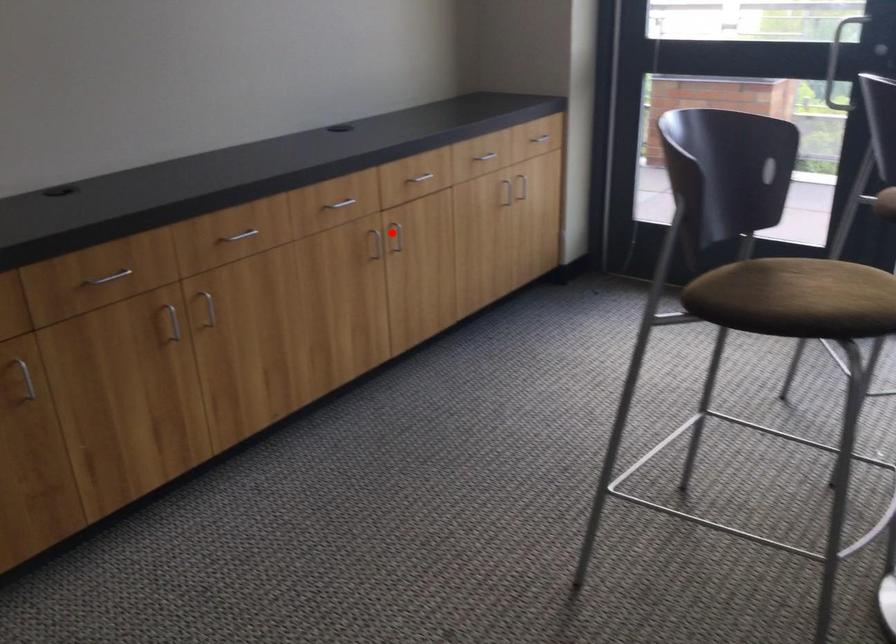
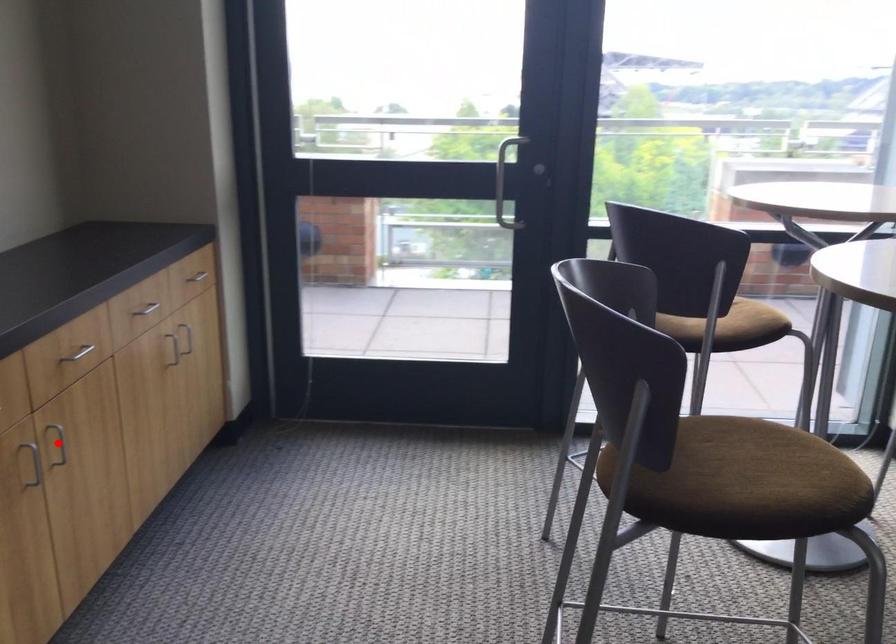
I am providing you with two images of the same scene from different viewpoints. A red point is marked on the first image and another point is marked on the second image. Is the red point in image1 aligned with the point shown in image2?

Yes